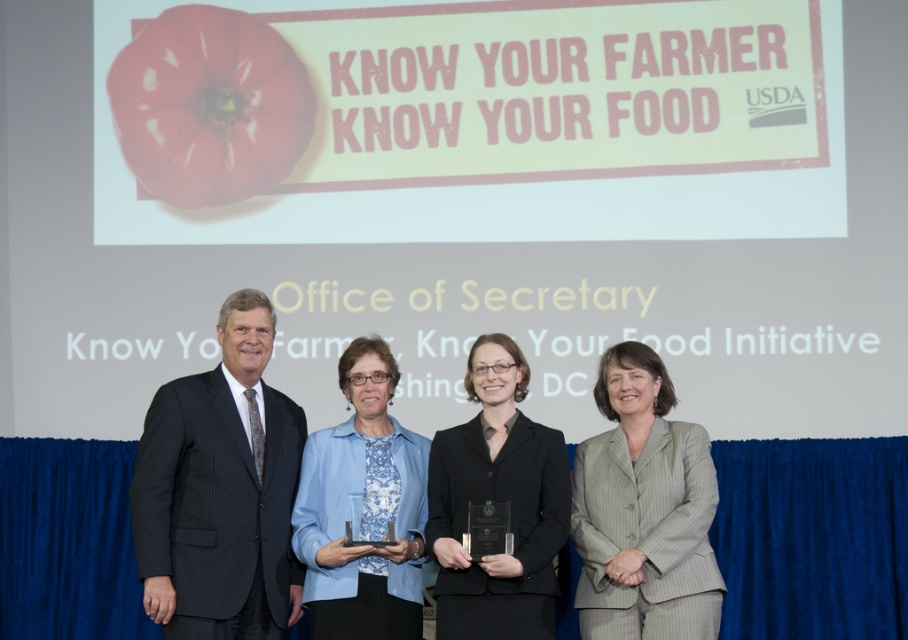
Consider the image. Is black pinstripe suit at left smaller than matte red tomato at upper left?

No, black pinstripe suit at left is not smaller than matte red tomato at upper left.

Find the location of a particular element. Image resolution: width=908 pixels, height=640 pixels. black pinstripe suit at left is located at coordinates (220, 492).

Who is positioned more to the right, black pinstripe suit at left or blue printed blouse at center?

Positioned to the right is blue printed blouse at center.

You are a GUI agent. You are given a task and a screenshot of the screen. Output one action in this format:
    pyautogui.click(x=<x>, y=<y>)
    Task: Click on the black pinstripe suit at left
    The image size is (908, 640).
    Given the screenshot: What is the action you would take?
    pyautogui.click(x=220, y=492)

Can you confirm if gray pinstripe suit at center is positioned to the left of blue printed blouse at center?

Incorrect, gray pinstripe suit at center is not on the left side of blue printed blouse at center.

Can you confirm if gray pinstripe suit at center is thinner than blue printed blouse at center?

Incorrect, gray pinstripe suit at center's width is not less than blue printed blouse at center's.

Find the location of a particular element. gray pinstripe suit at center is located at coordinates (643, 509).

At what (x,y) coordinates should I click in order to perform the action: click on gray pinstripe suit at center. Please return your answer as a coordinate pair (x, y). The height and width of the screenshot is (640, 908). Looking at the image, I should click on (643, 509).